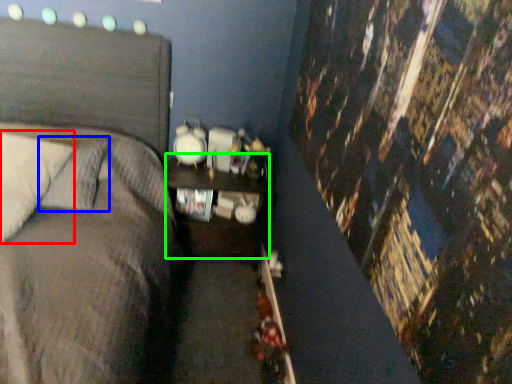
Question: Based on their relative distances, which object is nearer to pillow (highlighted by a red box)? Choose from pillow (highlighted by a blue box) and nightstand (highlighted by a green box).

Choices:
 (A) pillow
 (B) nightstand

Answer: (A)